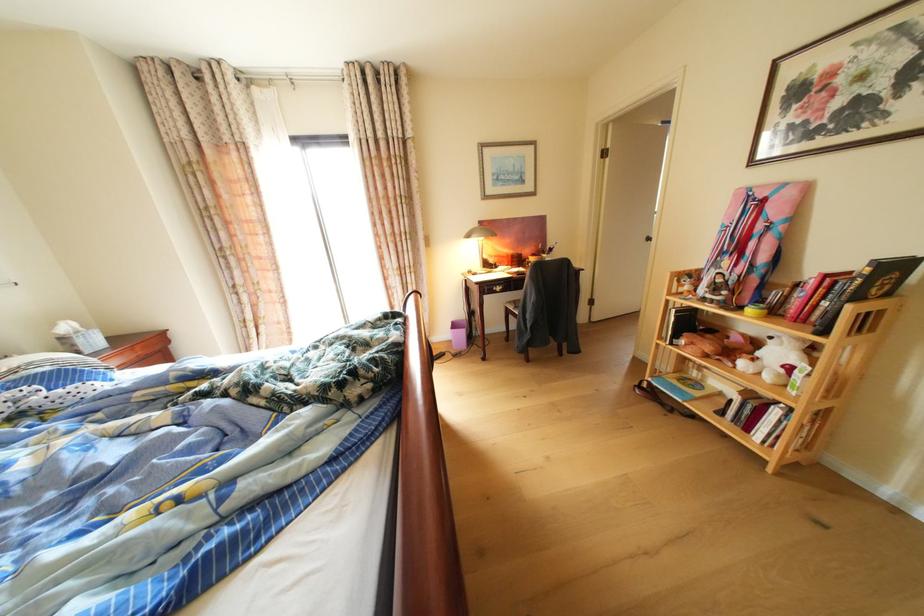
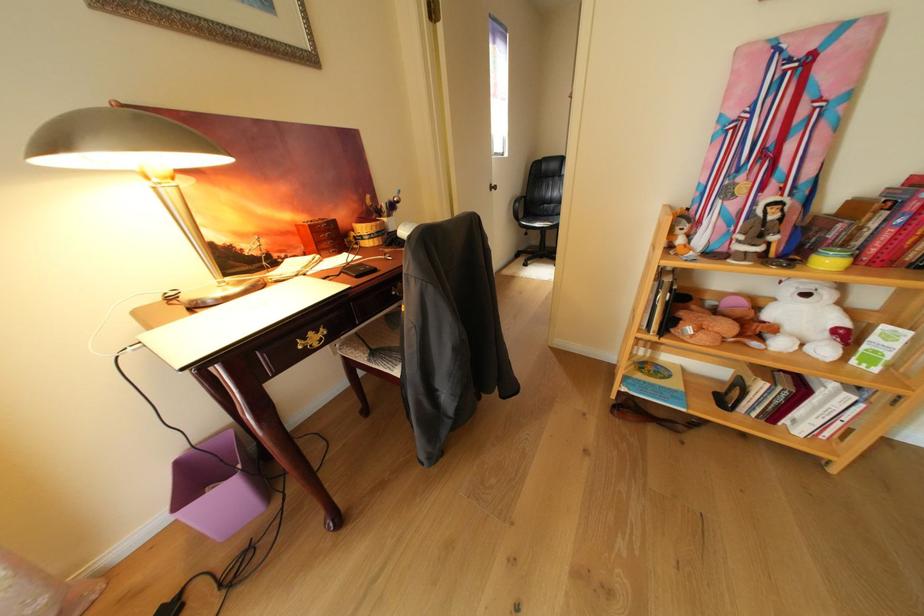
Find the pixel in the second image that matches [663,381] in the first image.

(638, 391)